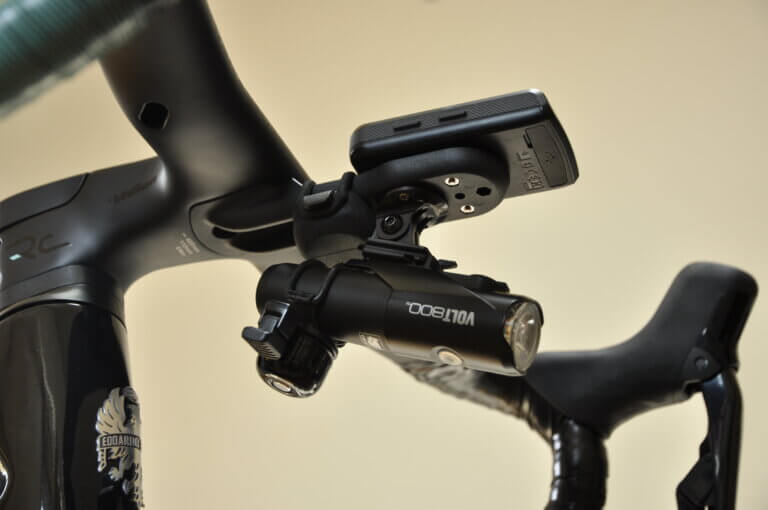
Identify the location of wall. (657, 129), (335, 43), (210, 403), (409, 474).